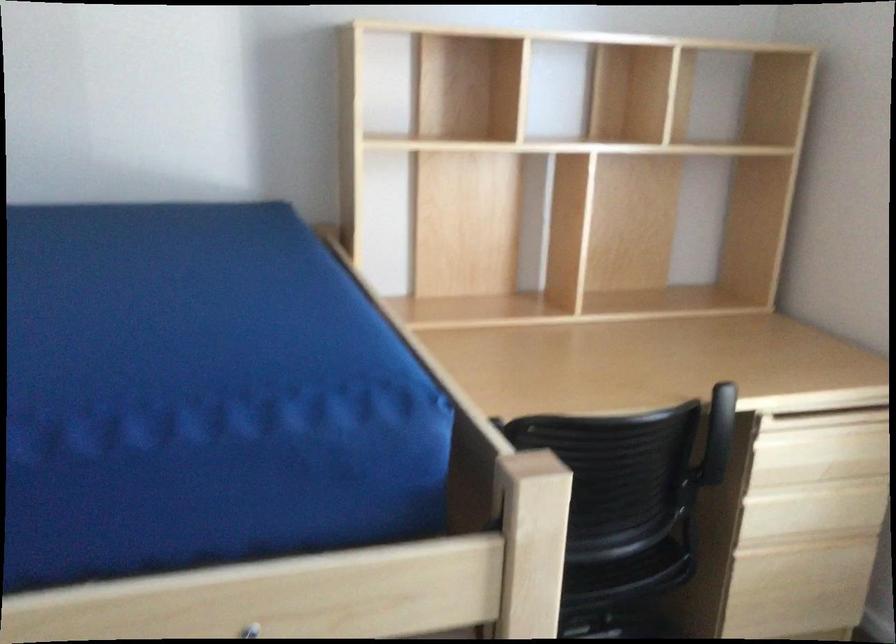
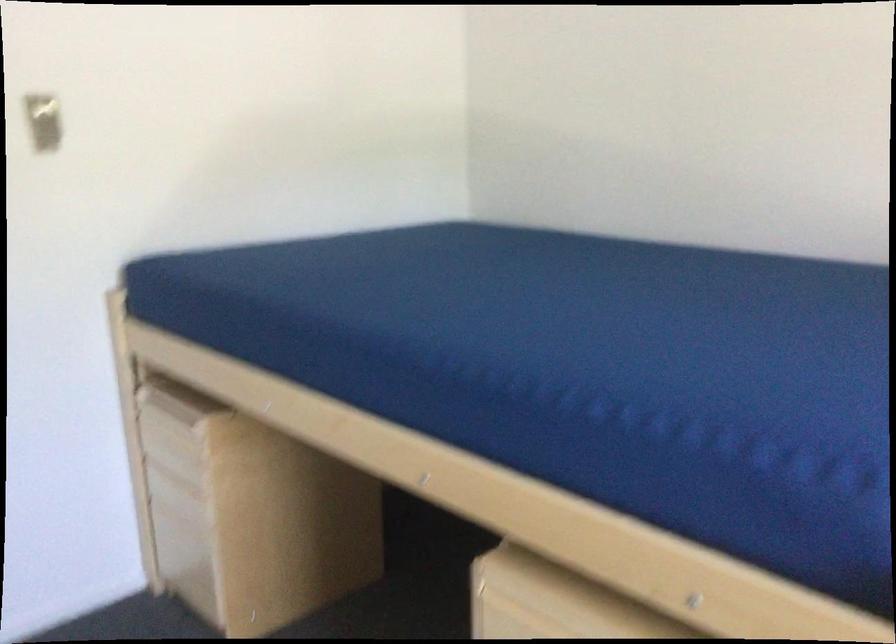
Question: The camera is either moving clockwise (left) or counter-clockwise (right) around the object. The first image is from the beginning of the video and the second image is from the end. Is the camera moving left or right when shooting the video?

Choices:
 (A) Left
 (B) Right

Answer: (B)